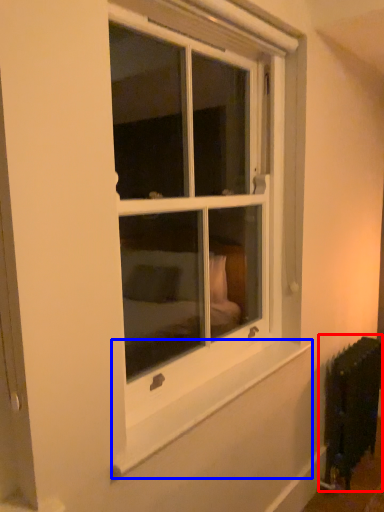
Question: Which object appears farthest to the camera in this image, radiator (highlighted by a red box) or window sill (highlighted by a blue box)?

Choices:
 (A) radiator
 (B) window sill

Answer: (A)